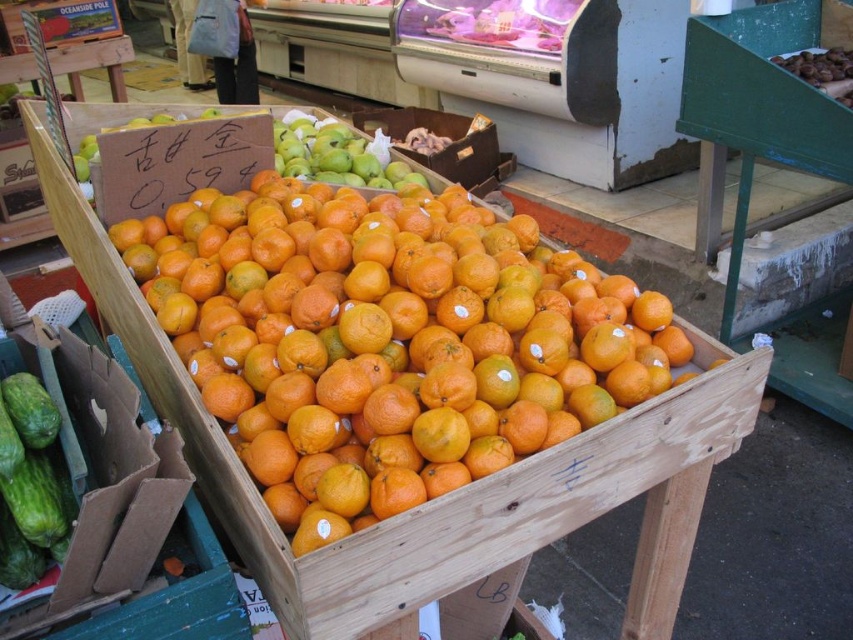
What do you see at coordinates (387, 340) in the screenshot? Image resolution: width=853 pixels, height=640 pixels. I see `orange matte at center` at bounding box center [387, 340].

Does orange matte at center appear under green matte cucumber at lower left?

No, orange matte at center is not below green matte cucumber at lower left.

Is point (599, 381) positioned behind point (38, 508)?

Yes.

I want to click on orange matte at center, so click(387, 340).

Locate an element on the screen. The height and width of the screenshot is (640, 853). green matte cucumber at lower left is located at coordinates (28, 483).

Is point (10, 433) positioned before point (306, 128)?

Yes, it is in front of point (306, 128).

Describe the element at coordinates (28, 483) in the screenshot. I see `green matte cucumber at lower left` at that location.

I want to click on green matte cucumber at lower left, so click(x=28, y=483).

Is orange matte at center below green matte apples at upper center?

Indeed, orange matte at center is positioned under green matte apples at upper center.

Does orange matte at center have a larger size compared to green matte apples at upper center?

Yes.

Does point (515, 406) come closer to viewer compared to point (276, 140)?

That is True.

This screenshot has height=640, width=853. In order to click on orange matte at center in this screenshot , I will do `click(387, 340)`.